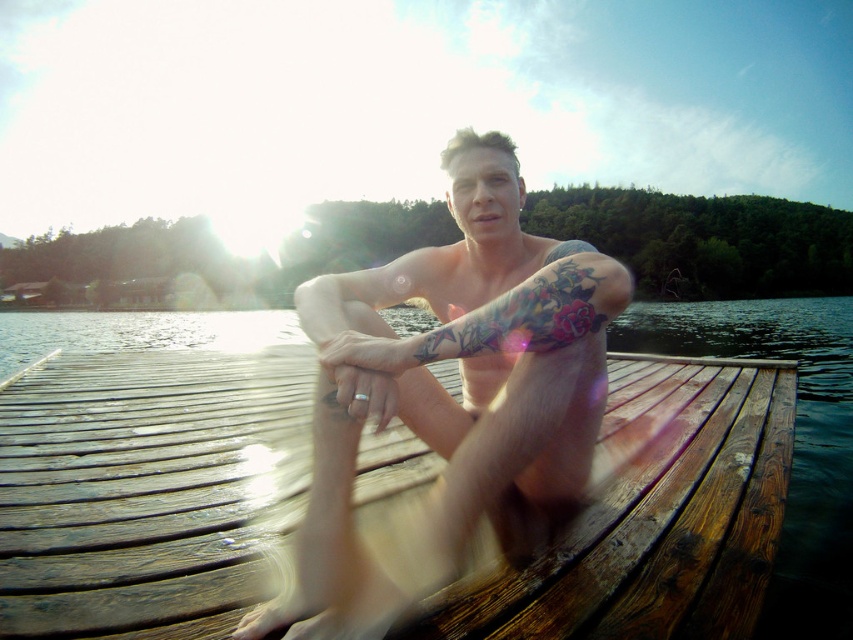
You are a photographer trying to capture the scene. You want to ensure that the brown wooden dock at center and the smooth skin man at center are both visible in your shot. Based on their heights, which object would appear larger in the photo?

The smooth skin man at center would appear larger in the photo because the brown wooden dock at center is not as tall as him.

You are a photographer standing in front of the scene. You want to take a photo of the smooth skin man at center and the brown wooden dock at center. Which object is closer to your camera lens?

The brown wooden dock at center is closer to the camera lens because it is further to the viewer than the smooth skin man at center.